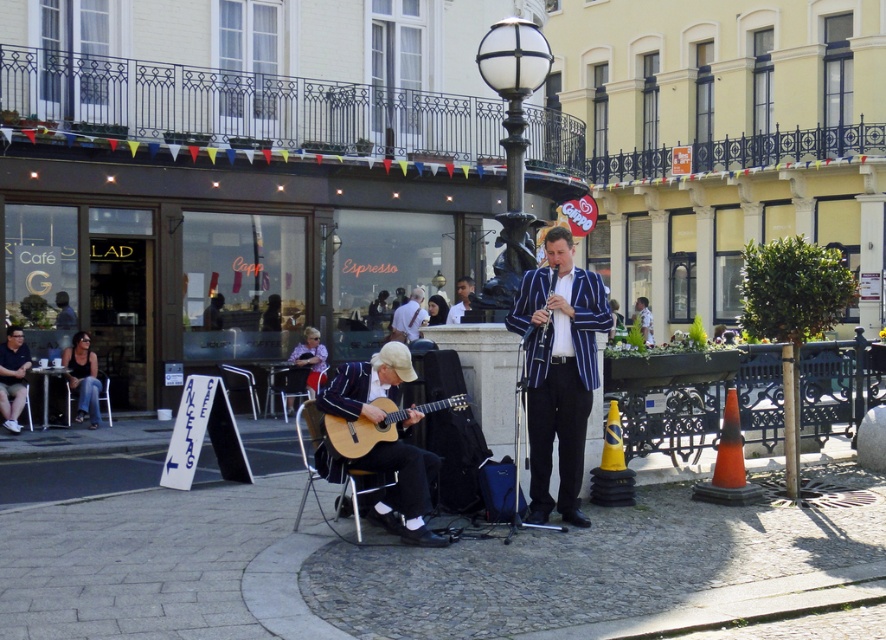
Question: Does striped fabric blazer at center appear under denim jeans at lower left?

Choices:
 (A) no
 (B) yes

Answer: (A)

Question: From the image, what is the correct spatial relationship of wooden acoustic guitar at center in relation to white glass lamp post at upper center?

Choices:
 (A) right
 (B) left

Answer: (B)

Question: Which object is closer to the camera taking this photo?

Choices:
 (A) striped fabric blazer at center
 (B) denim jeans at lower left

Answer: (A)

Question: Does striped fabric blazer at center appear on the left side of wooden acoustic guitar at center?

Choices:
 (A) yes
 (B) no

Answer: (B)

Question: Which point is farther to the camera?

Choices:
 (A) (79, 404)
 (B) (342, 451)
 (C) (504, 81)

Answer: (A)

Question: Estimate the real-world distances between objects in this image. Which object is closer to the wooden acoustic guitar at center?

Choices:
 (A) striped fabric blazer at center
 (B) light brown wooden guitar at lower center

Answer: (B)